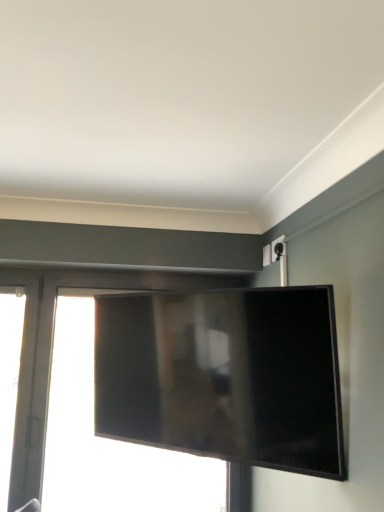
Question: From the image's perspective, relative to transparent glass window at left, marked as the first window in a left-to-right arrangement, is matte black tv at center above or below?

Choices:
 (A) above
 (B) below

Answer: (A)

Question: In the image, is matte black tv at center on the left side or the right side of transparent glass window at left, marked as the first window in a left-to-right arrangement?

Choices:
 (A) right
 (B) left

Answer: (A)

Question: Which is nearer to the matte black tv at center?

Choices:
 (A) transparent glass window at center, which appears as the second window when viewed from the left
 (B) transparent glass window at left, marked as the first window in a left-to-right arrangement

Answer: (A)

Question: Considering the real-world distances, which object is farthest from the matte black tv at center?

Choices:
 (A) transparent glass window at left, which is the second window from right to left
 (B) transparent glass window at center, which appears as the second window when viewed from the left

Answer: (A)